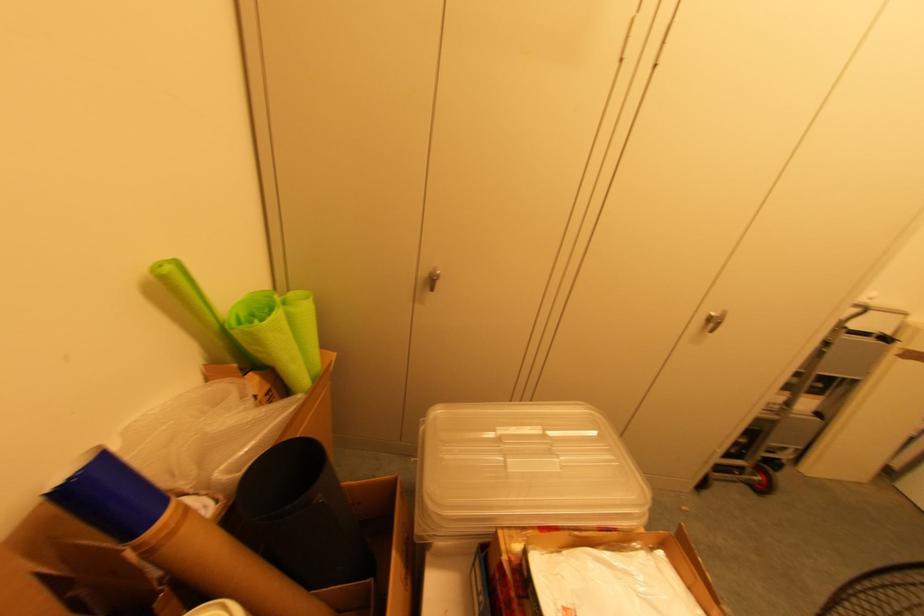
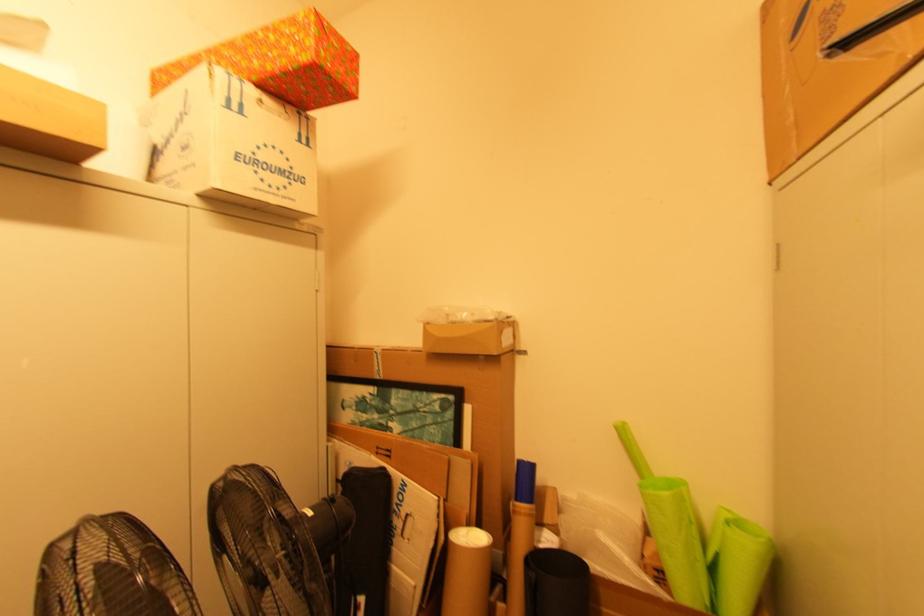
Question: The first image is from the beginning of the video and the second image is from the end. How did the camera likely rotate when shooting the video?

Choices:
 (A) Left
 (B) Right
 (C) Up
 (D) Down

Answer: (A)